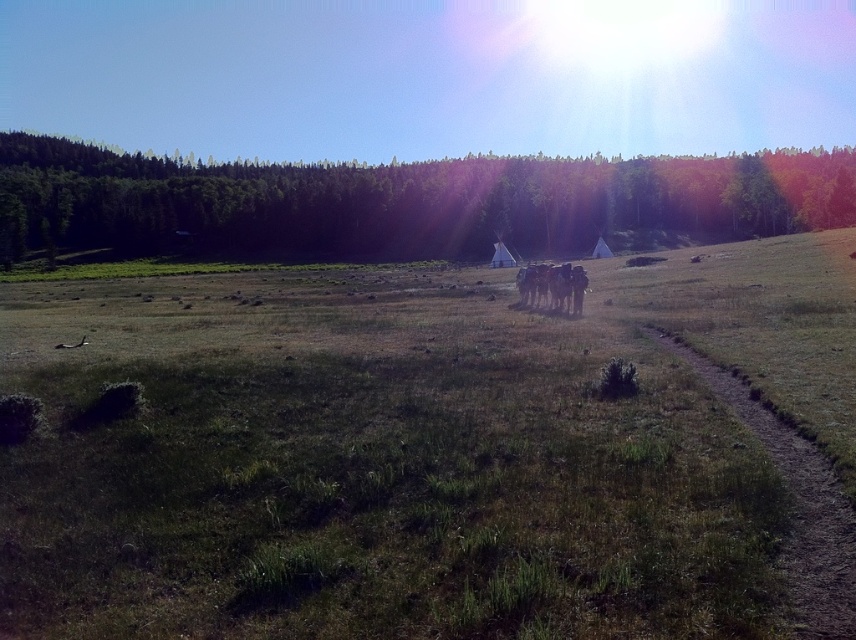
You are a hiker trying to locate the brown woolen herd at center from the dirt path in the foreground. Which direction should you look relative to the green leafy tree at upper center to find them?

The brown woolen herd at center is behind the green leafy tree at upper center, so you should look behind the green leafy tree at upper center to find them.

You are a hiker trying to locate the brown woolen herd at center from the green leafy tree at upper center. Which direction should you head towards?

The green leafy tree at upper center is positioned on the left side of brown woolen herd at center, so you should head towards the right to locate the brown woolen herd at center from the green leafy tree at upper center.